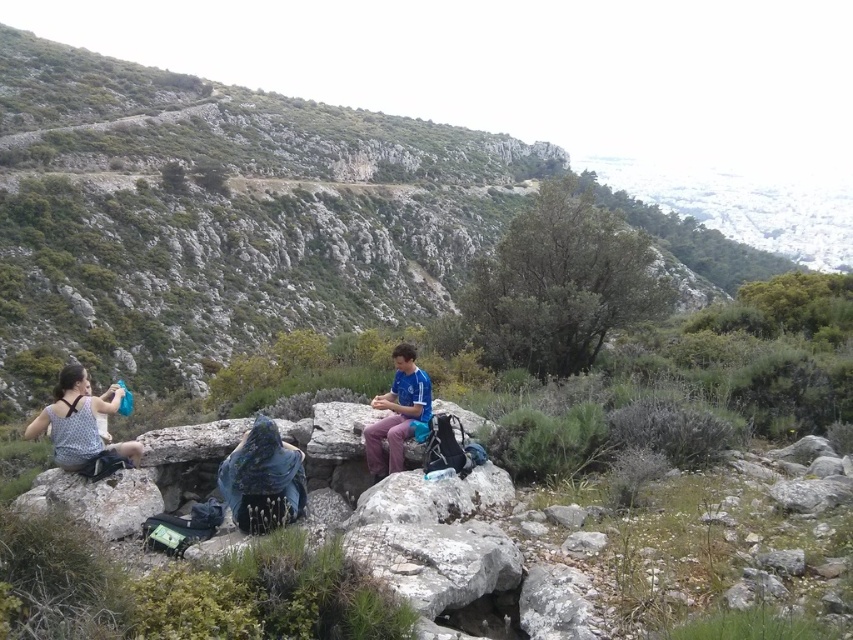
You are a GUI agent. You are given a task and a screenshot of the screen. Output one action in this format:
    pyautogui.click(x=<x>, y=<y>)
    Task: Click on the polka dot fabric backpack at lower left
    This screenshot has height=640, width=853.
    Given the screenshot: What is the action you would take?
    pyautogui.click(x=82, y=426)

What are the coordinates of `polka dot fabric backpack at lower left` in the screenshot? It's located at (82, 426).

Locate an element on the screen. The width and height of the screenshot is (853, 640). polka dot fabric backpack at lower left is located at coordinates (82, 426).